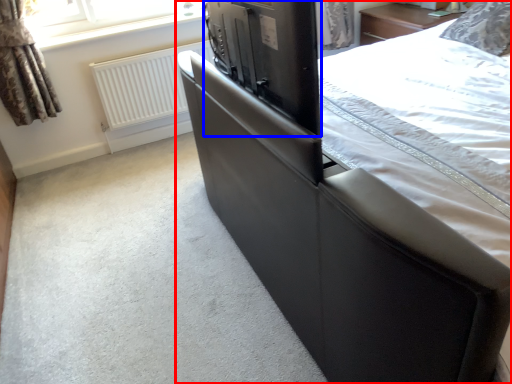
Question: Which object appears farthest to the camera in this image, bed (highlighted by a red box) or appliance (highlighted by a blue box)?

Choices:
 (A) bed
 (B) appliance

Answer: (B)